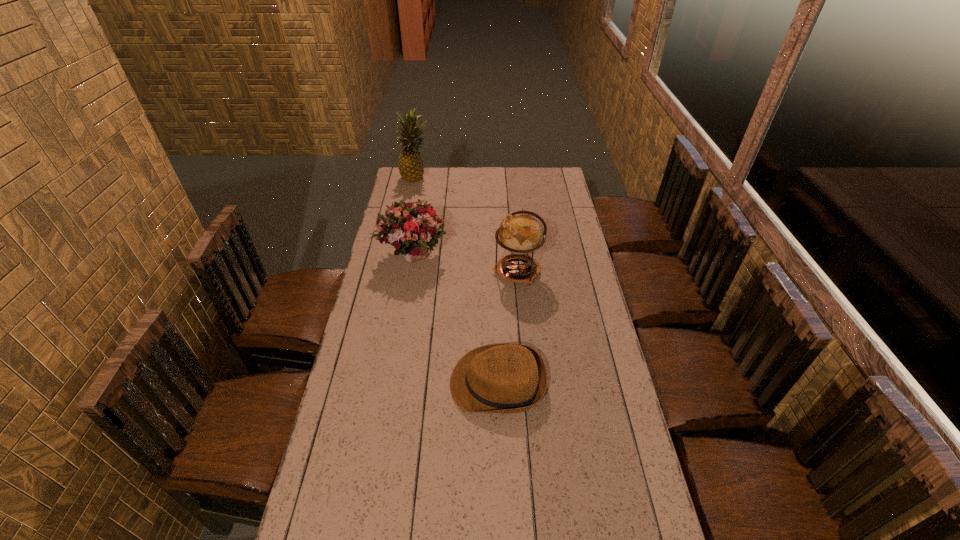
Where is `pineapple`? The height and width of the screenshot is (540, 960). pineapple is located at coordinates (411, 168).

Find the location of `the farthest object`. the farthest object is located at coordinates point(411,168).

Where is `the third shortest object`? Image resolution: width=960 pixels, height=540 pixels. the third shortest object is located at coordinates (520, 232).

At what (x,y) coordinates should I click in order to perform the action: click on bouquet. Please return your answer as a coordinate pair (x, y). Looking at the image, I should click on (412, 228).

Where is `fedora`? Image resolution: width=960 pixels, height=540 pixels. fedora is located at coordinates (499, 378).

What are the coordinates of `the nearest object` in the screenshot? It's located at (x=499, y=378).

Find the location of `vacant space located 0.120m on the front of the tallest object`. vacant space located 0.120m on the front of the tallest object is located at coordinates (412, 198).

The image size is (960, 540). In order to click on vacant area located 0.110m at the center of the second tallest object in this screenshot , I will do `click(467, 272)`.

At what (x,y) coordinates should I click in order to perform the action: click on free space located at the center of the second tallest object. Please return your answer as a coordinate pair (x, y). Looking at the image, I should click on (402, 272).

Identify the location of free space located 0.310m at the center of the second tallest object. (x=419, y=272).